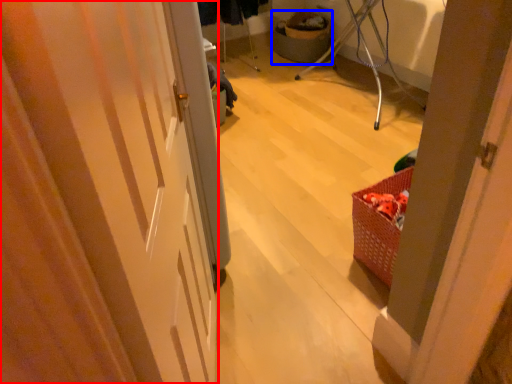
Question: Which object is further to the camera taking this photo, door (highlighted by a red box) or basket (highlighted by a blue box)?

Choices:
 (A) door
 (B) basket

Answer: (B)